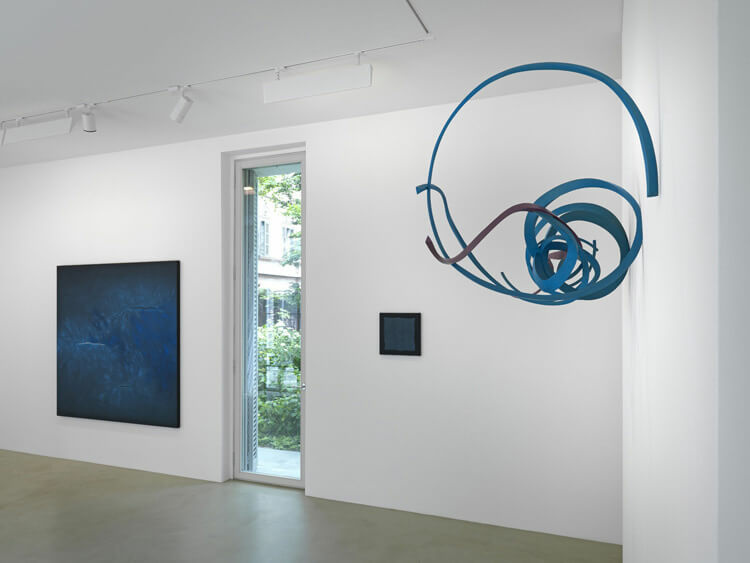
Where is `floor`? floor is located at coordinates (322, 509).